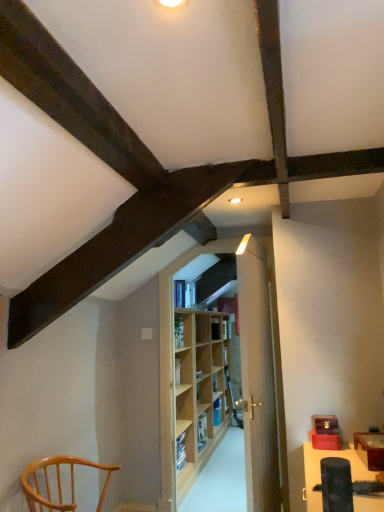
Question: Is wooden bookshelf at center, placed as the 1th shelf when sorted from bottom to top, at the back of light wood door at center?

Choices:
 (A) yes
 (B) no

Answer: (B)

Question: Is light wood door at center with wooden bookshelf at center, marked as the first shelf in a back-to-front arrangement?

Choices:
 (A) no
 (B) yes

Answer: (A)

Question: Does light wood door at center have a lesser height compared to wooden bookshelf at center, marked as the 2th shelf in a top-to-bottom arrangement?

Choices:
 (A) yes
 (B) no

Answer: (B)

Question: Can you confirm if light wood door at center is wider than wooden bookshelf at center, acting as the 1th shelf starting from the right?

Choices:
 (A) no
 (B) yes

Answer: (B)

Question: Is light wood door at center to the left of wooden bookshelf at center, acting as the 1th shelf starting from the right, from the viewer's perspective?

Choices:
 (A) yes
 (B) no

Answer: (B)

Question: Is light wood door at center in front of or behind wooden bookshelf at center, positioned as the 2th shelf in front-to-back order, in the image?

Choices:
 (A) front
 (B) behind

Answer: (A)

Question: In terms of height, does light wood door at center look taller or shorter compared to wooden bookshelf at center, positioned as the 2th shelf in front-to-back order?

Choices:
 (A) short
 (B) tall

Answer: (B)

Question: In terms of width, does light wood door at center look wider or thinner when compared to wooden bookshelf at center, placed as the 1th shelf when sorted from bottom to top?

Choices:
 (A) thin
 (B) wide

Answer: (B)

Question: Considering the positions of point (273, 374) and point (218, 408), is point (273, 374) closer or farther from the camera than point (218, 408)?

Choices:
 (A) closer
 (B) farther

Answer: (A)

Question: From their relative heights in the image, would you say light brown wood chair at lower left is taller or shorter than wooden bookshelf at center, arranged as the 2th shelf when viewed from the left?

Choices:
 (A) tall
 (B) short

Answer: (A)

Question: Based on their positions, is light brown wood chair at lower left located to the left or right of wooden bookshelf at center, marked as the 2th shelf in a top-to-bottom arrangement?

Choices:
 (A) right
 (B) left

Answer: (B)

Question: Looking at their shapes, would you say light brown wood chair at lower left is wider or thinner than wooden bookshelf at center, marked as the first shelf in a back-to-front arrangement?

Choices:
 (A) thin
 (B) wide

Answer: (B)

Question: Considering their positions, is light brown wood chair at lower left located in front of or behind wooden bookshelf at center, acting as the 1th shelf starting from the right?

Choices:
 (A) behind
 (B) front

Answer: (B)

Question: Is matte black speaker at lower right in front of or behind light brown wood chair at lower left in the image?

Choices:
 (A) front
 (B) behind

Answer: (A)

Question: Considering the positions of matte black speaker at lower right and light brown wood chair at lower left in the image, is matte black speaker at lower right taller or shorter than light brown wood chair at lower left?

Choices:
 (A) short
 (B) tall

Answer: (B)